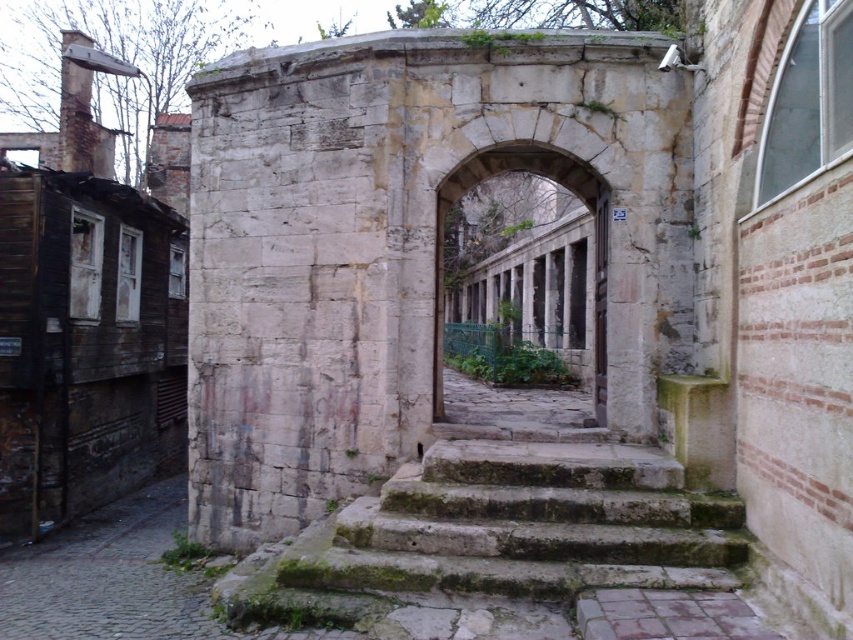
You are standing in front of the ancient stone structure and need to reach the entrance located at the green mossy stone stairs at center. Based on the coordinates provided, can you determine the direction you should walk to reach the stairs?

The green mossy stone stairs at center are located at coordinates point (x=525, y=524). Since the stairs are at the center, you should walk straight towards them to reach the entrance.

You are standing in front of the ancient stone structure. You want to enter the passageway through the archway. Which object should you walk towards first, the green mossy stone stairs at center or the stone archway at center?

You should walk towards the green mossy stone stairs at center first because it is in front of the stone archway at center, so you must step onto the stairs before reaching the archway.

You are standing at the entrance of the ancient stone structure and see two points marked in the image. The first point is at coordinates point (405, 476) and the second point is at point (601, 349). Which point is closer to you?

Point (405, 476) is in front of point (601, 349), so it is closer to you.